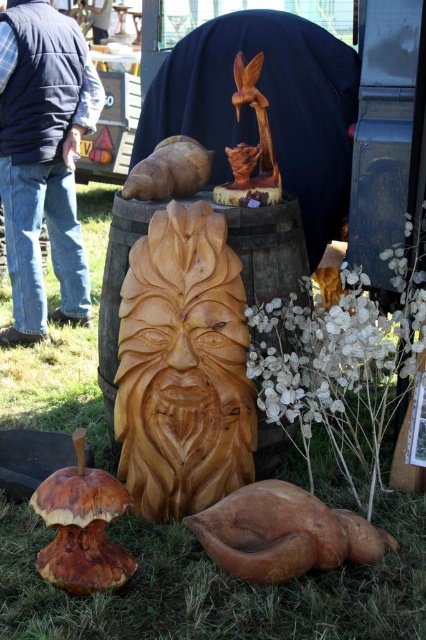
You are a delivery person who needs to place a package between the green matte wood carving at center and the wooden bird at upper center. The package is 1.2 meters long. Can you fit it between them without tilting?

The distance between the green matte wood carving at center and the wooden bird at upper center is 1.04 meters, which is shorter than the package length of 1.2 meters. Therefore, the package cannot fit between them without tilting.

You are at an outdoor craft fair and see two wooden sculptures. One is the wooden duck at lower center and the other is the brown wood snail at upper center. Which sculpture is positioned to the right of the other?

The wooden duck at lower center is positioned to the right of the brown wood snail at upper center.

You are an art curator planning to photograph the green matte wood carving at center and the wooden carving at center. Based on their positions, which one should you focus on first if you want to capture both in a single frame without moving the camera?

The green matte wood carving at center is below the wooden carving at center, so you should focus on the wooden carving at center first as it is higher up and will be in the upper part of the frame, allowing the lower one to naturally fit into the composition without needing to adjust the camera angle.